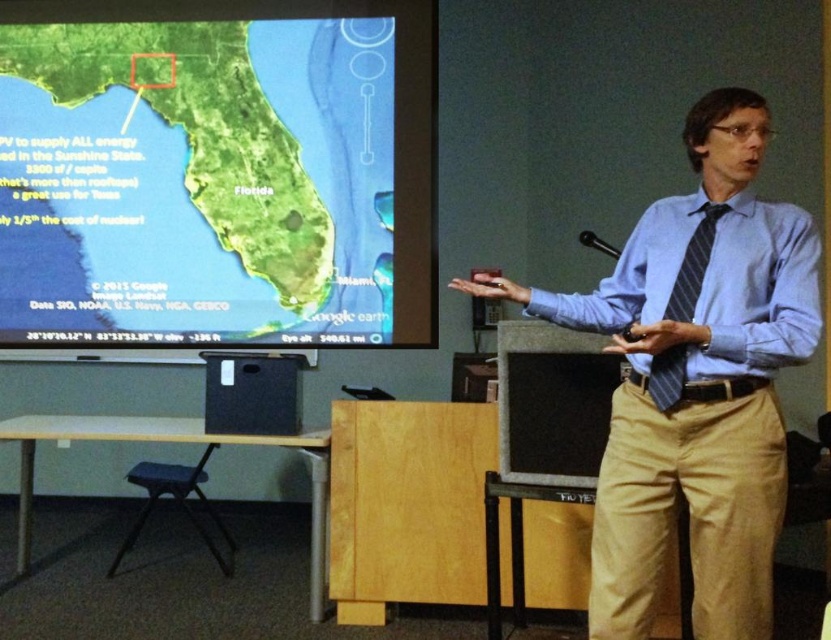
Does black plastic podium at lower left lie behind wooden stool at lower left?

No.

In the scene shown: Is black plastic podium at lower left above wooden stool at lower left?

Correct, black plastic podium at lower left is located above wooden stool at lower left.

Which is in front, point (318, 618) or point (165, 477)?

Point (318, 618) is in front.

Image resolution: width=831 pixels, height=640 pixels. What are the coordinates of `black plastic podium at lower left` in the screenshot? It's located at (176, 442).

Does striped fabric tie at right come in front of wooden stool at lower left?

Yes, it is in front of wooden stool at lower left.

From the picture: Does striped fabric tie at right have a greater height compared to wooden stool at lower left?

No.

Is point (667, 300) in front of point (161, 477)?

Yes, it is.

This screenshot has height=640, width=831. What are the coordinates of `striped fabric tie at right` in the screenshot? It's located at (692, 266).

Does blue striped dress shirt at right appear on the left side of striped fabric tie at right?

In fact, blue striped dress shirt at right is to the right of striped fabric tie at right.

Between blue striped dress shirt at right and striped fabric tie at right, which one has less height?

Standing shorter between the two is blue striped dress shirt at right.

Where is `blue striped dress shirt at right`? Image resolution: width=831 pixels, height=640 pixels. blue striped dress shirt at right is located at coordinates (758, 291).